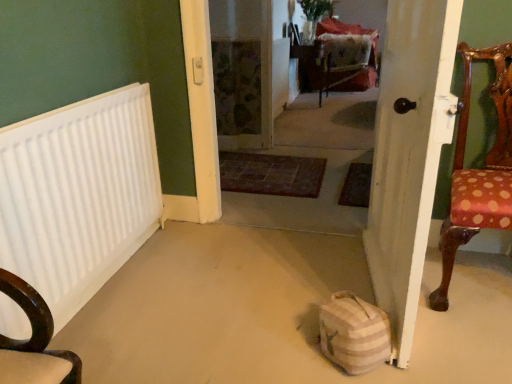
Where is `free location to the right of white matte radiator at left`? free location to the right of white matte radiator at left is located at coordinates (200, 299).